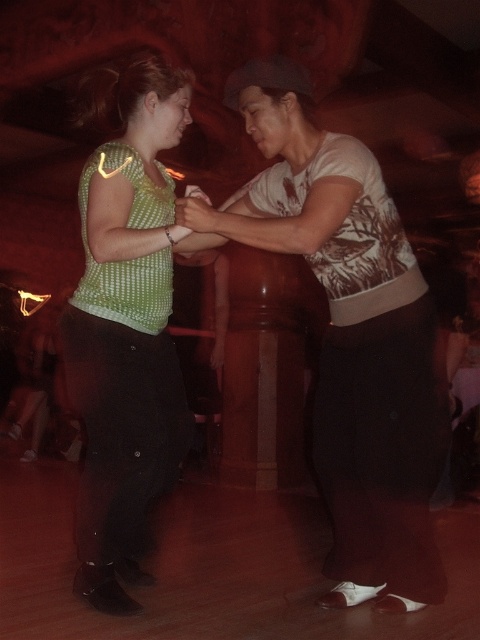
Which is below, green dotted shirt at center or green dotted blouse at center?

green dotted shirt at center is lower down.

Does green dotted shirt at center have a larger size compared to green dotted blouse at center?

Yes, green dotted shirt at center is bigger than green dotted blouse at center.

Between point (385, 317) and point (147, 80), which one is positioned behind?

Positioned behind is point (147, 80).

At what (x,y) coordinates should I click in order to perform the action: click on green dotted shirt at center. Please return your answer as a coordinate pair (x, y). The height and width of the screenshot is (640, 480). Looking at the image, I should click on (348, 333).